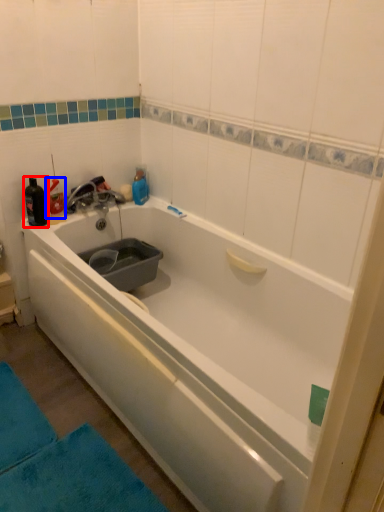
Question: Which object appears closest to the camera in this image, bottle (highlighted by a red box) or bottle (highlighted by a blue box)?

Choices:
 (A) bottle
 (B) bottle

Answer: (A)